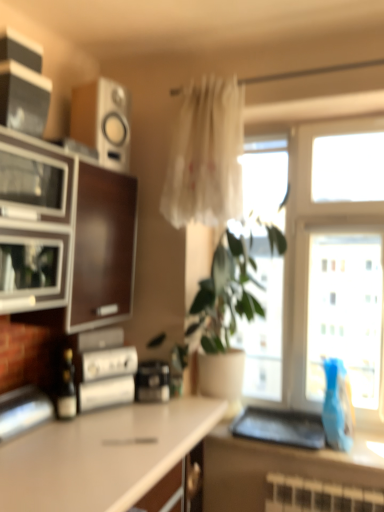
Find the location of a particular element. The height and width of the screenshot is (512, 384). vacant space in front of metallic silver toaster at left, which is the fourth appliance in top-to-bottom order is located at coordinates (23, 452).